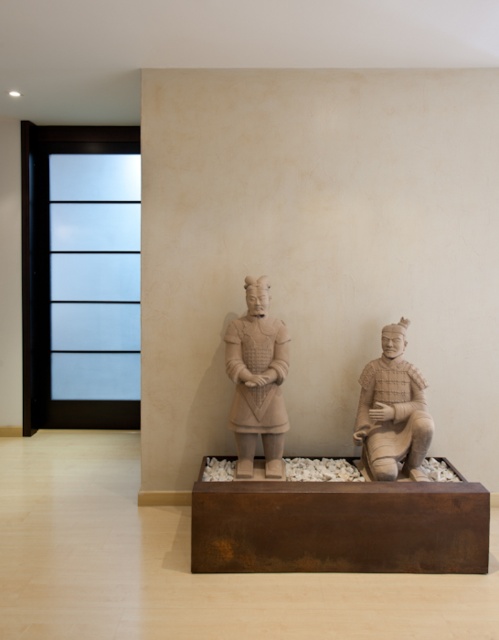
Question: Can you confirm if matte clay warrior at center is positioned to the right of matte clay figure at center?

Choices:
 (A) yes
 (B) no

Answer: (B)

Question: Which point is closer to the camera?

Choices:
 (A) (249, 458)
 (B) (399, 371)

Answer: (B)

Question: Can you confirm if matte clay warrior at center is positioned above matte clay figure at center?

Choices:
 (A) yes
 (B) no

Answer: (A)

Question: Which of the following is the farthest from the observer?

Choices:
 (A) matte clay warrior at center
 (B) matte clay figure at center

Answer: (A)

Question: Observing the image, what is the correct spatial positioning of matte clay warrior at center in reference to matte clay figure at center?

Choices:
 (A) right
 (B) left

Answer: (B)

Question: Which object is closer to the camera taking this photo?

Choices:
 (A) matte clay figure at center
 (B) matte clay warrior at center

Answer: (A)